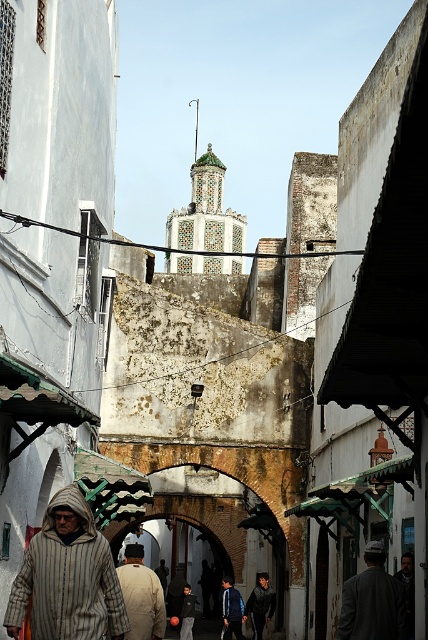
Does striped woolen robe at lower left have a greater width compared to light brown fabric jacket at lower left?

In fact, striped woolen robe at lower left might be narrower than light brown fabric jacket at lower left.

Does striped woolen robe at lower left appear over light brown fabric jacket at lower left?

Yes, striped woolen robe at lower left is above light brown fabric jacket at lower left.

Find the location of a particular element. The height and width of the screenshot is (640, 428). striped woolen robe at lower left is located at coordinates (68, 577).

Locate an element on the screen. This screenshot has height=640, width=428. striped woolen robe at lower left is located at coordinates (68, 577).

Which is more to the left, dark blue jacket at center or blue denim jacket at center?

blue denim jacket at center

Who is lower down, dark blue jacket at center or blue denim jacket at center?

blue denim jacket at center is below.

Which is in front, point (269, 595) or point (225, 584)?

Point (269, 595)

Locate an element on the screen. dark blue jacket at center is located at coordinates (259, 605).

Measure the distance from striped woolen robe at lower left to dark gray woolen jacket at center.

The distance of striped woolen robe at lower left from dark gray woolen jacket at center is 33.11 feet.

Is striped woolen robe at lower left below dark gray woolen jacket at center?

No, striped woolen robe at lower left is not below dark gray woolen jacket at center.

Does point (24, 600) come behind point (365, 628)?

No, it is in front of (365, 628).

The height and width of the screenshot is (640, 428). I want to click on striped woolen robe at lower left, so click(68, 577).